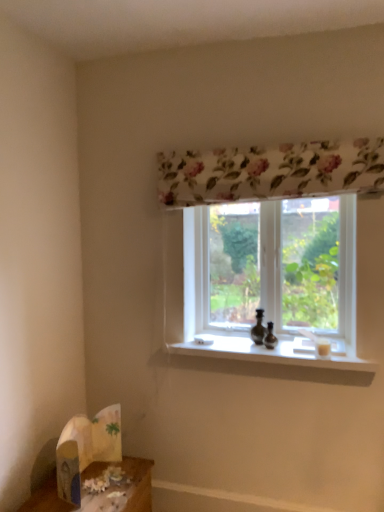
Image resolution: width=384 pixels, height=512 pixels. I want to click on blank space situated above wooden table at lower left (from a real-world perspective), so click(97, 492).